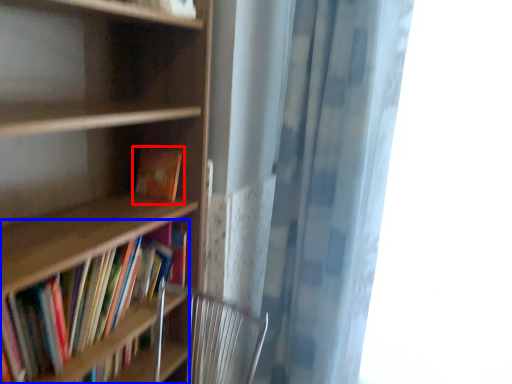
Question: Which object appears closest to the camera in this image, book (highlighted by a red box) or book (highlighted by a blue box)?

Choices:
 (A) book
 (B) book

Answer: (B)